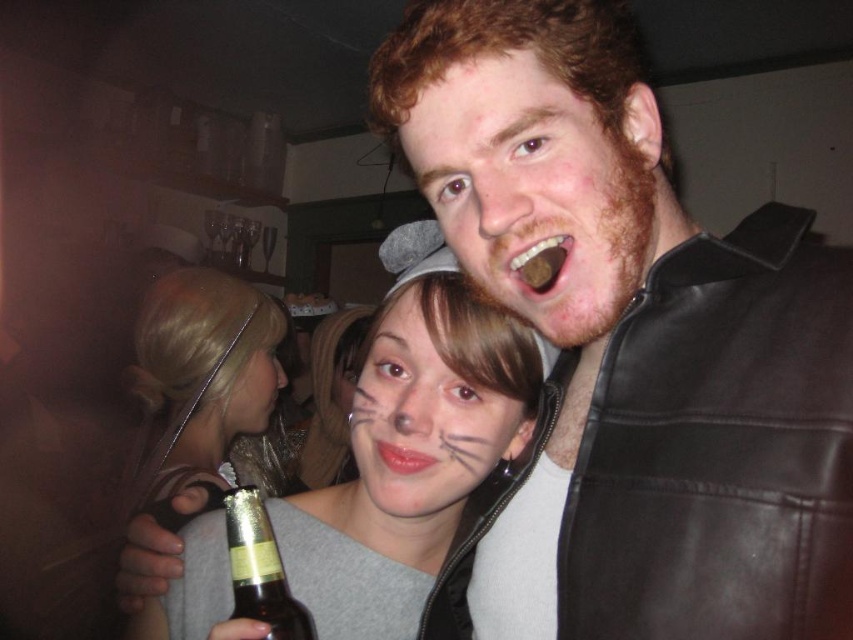
Question: Which object is closer to the camera taking this photo?

Choices:
 (A) gray matte headband at center
 (B) brown glass bottle at lower left

Answer: (B)

Question: Considering the real-world distances, which object is closest to the glossy matte lips at center?

Choices:
 (A) matte gray sweater at center
 (B) brown matte chocolate at upper center

Answer: (B)

Question: Which point is closer to the camera?

Choices:
 (A) (244, 449)
 (B) (519, 272)
 (C) (534, 260)
 (D) (338, 406)

Answer: (C)

Question: Can you confirm if matte black leather jacket at upper right is bigger than matte gray cat ears at center?

Choices:
 (A) no
 (B) yes

Answer: (A)

Question: Can you confirm if matte gray sweater at center is positioned to the right of smooth matte gray cat ears at center?

Choices:
 (A) yes
 (B) no

Answer: (B)

Question: Is matte gray sweater at center positioned in front of matte gray cat ears at center?

Choices:
 (A) yes
 (B) no

Answer: (A)